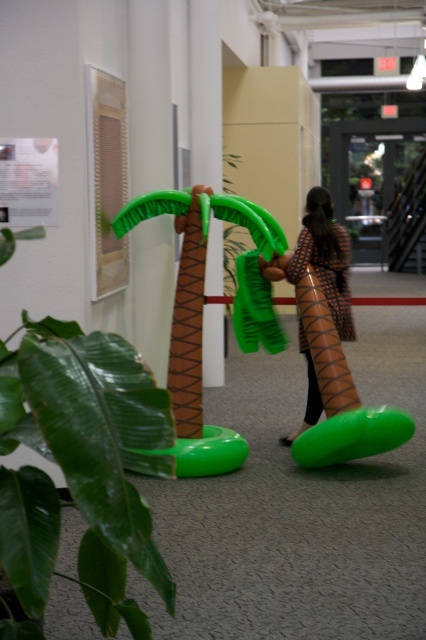
You are organizing a hallway event and need to place decorations. You have a green rubber plant at left and a brown textured dress at center. Which decoration takes up more space in the hallway?

The green rubber plant at left has a larger size compared to the brown textured dress at center, so it takes up more space in the hallway.

You are standing in the hallway and see the inflatable palm tree and the point at coordinates (80, 467). What object is located at that point?

The point at coordinates (80, 467) corresponds to the green rubber plant at left.